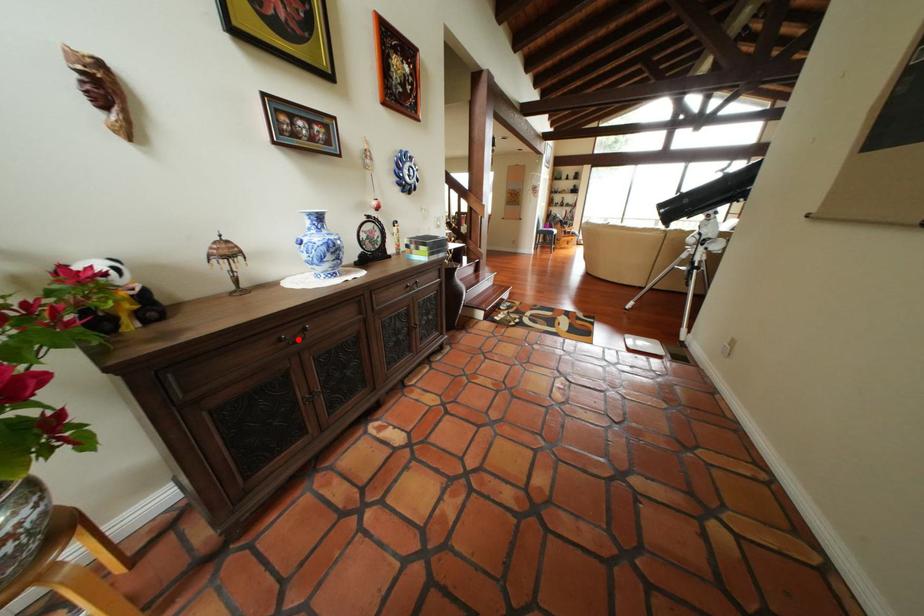
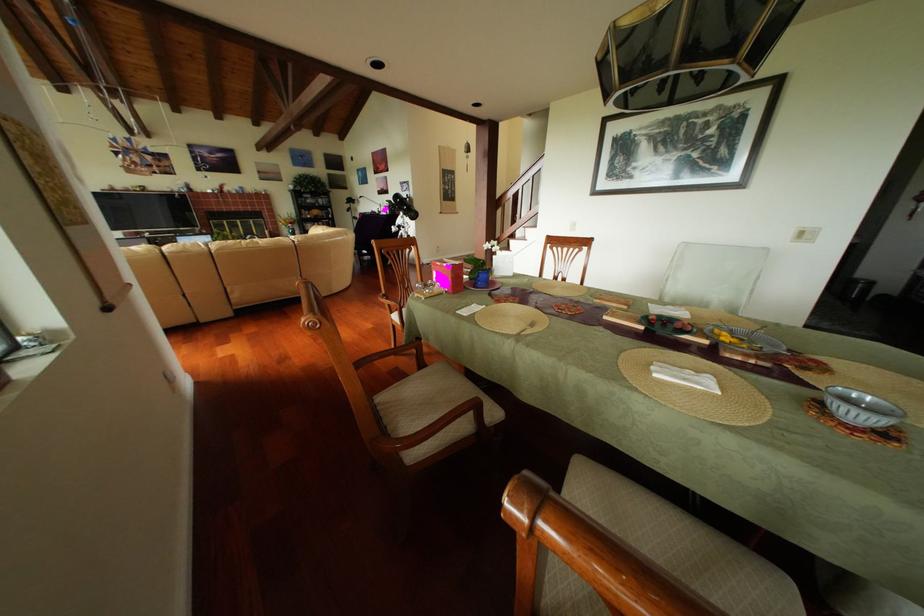
Question: I am providing you with two images of the same scene from different viewpoints. A red point is marked on the first image. Is the red point's position out of view in image 2?

Choices:
 (A) Yes
 (B) No

Answer: (A)